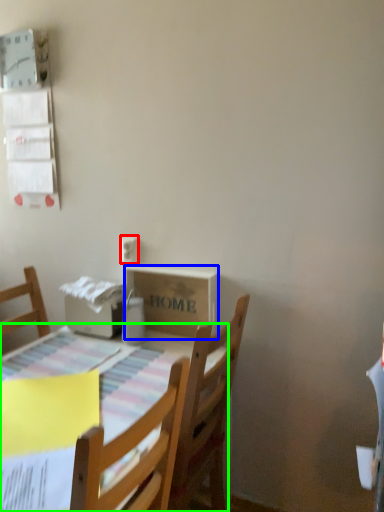
Question: Which object is the farthest from electric outlet (highlighted by a red box)? Choose among these: cardboard box (highlighted by a blue box) or table (highlighted by a green box).

Choices:
 (A) cardboard box
 (B) table

Answer: (B)